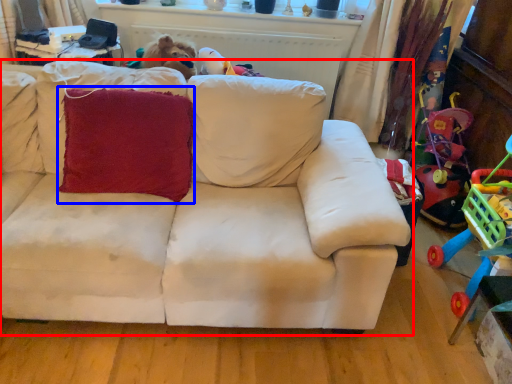
Question: Among these objects, which one is nearest to the camera, studio couch (highlighted by a red box) or throw pillow (highlighted by a blue box)?

Choices:
 (A) studio couch
 (B) throw pillow

Answer: (A)